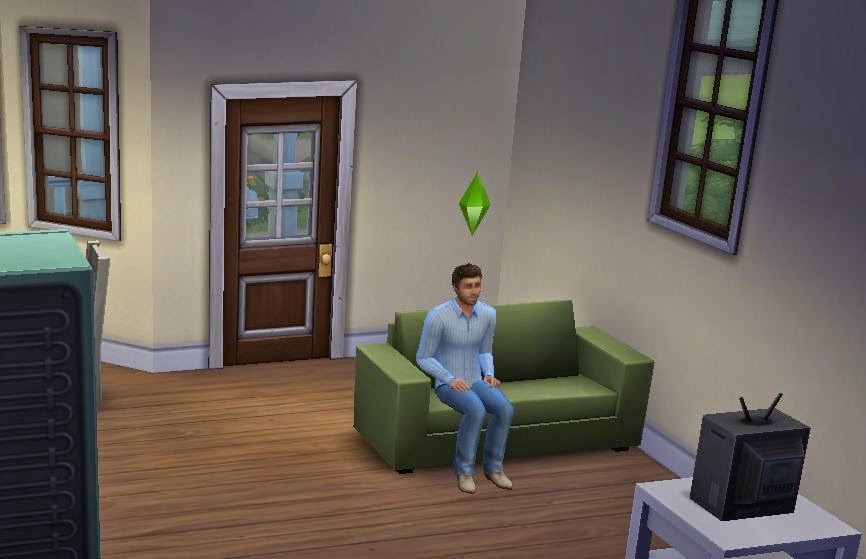
You are a GUI agent. You are given a task and a screenshot of the screen. Output one action in this format:
    pyautogui.click(x=<x>, y=<y>)
    Task: Click on the door knob
    This screenshot has height=559, width=866.
    Given the screenshot: What is the action you would take?
    pyautogui.click(x=326, y=260)